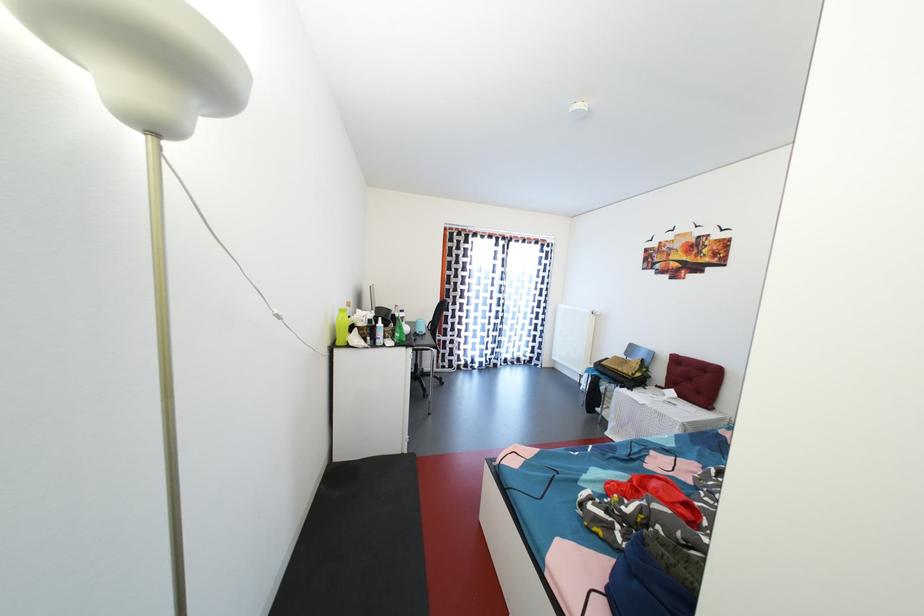
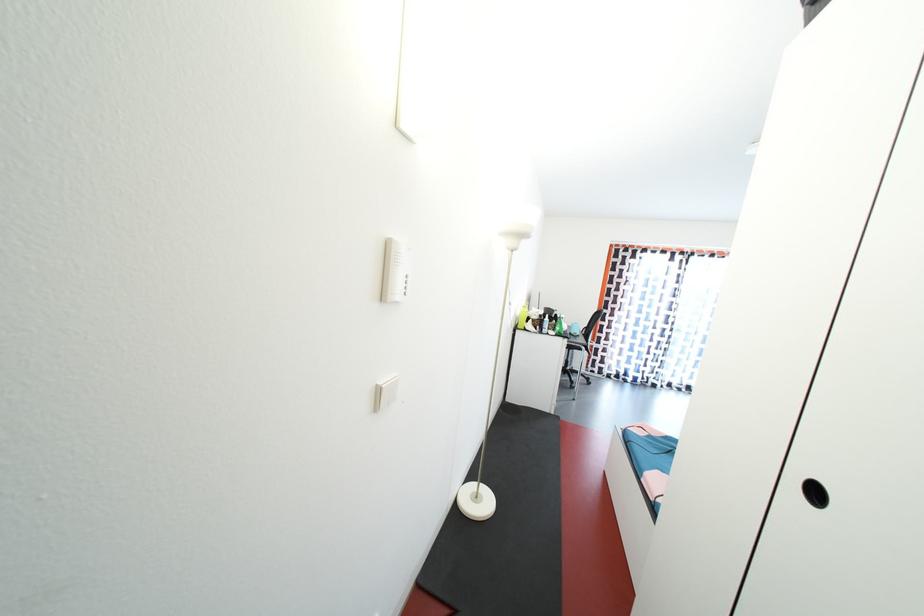
Question: Based on the continuous images, in which direction is the camera rotating? Reply with the corresponding letter.

Choices:
 (A) Left
 (B) Right
 (C) Up
 (D) Down

Answer: (A)